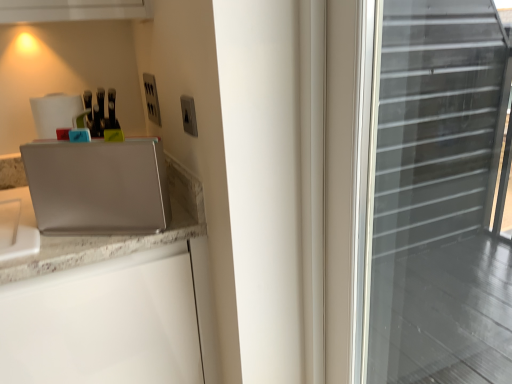
Identify the location of satin silver switch at upper center, which is the 2th electric outlet from back to front. (189, 115).

The width and height of the screenshot is (512, 384). Find the location of `satin silver outlet at upper center, placed as the 1th electric outlet when sorted from left to right`. satin silver outlet at upper center, placed as the 1th electric outlet when sorted from left to right is located at coordinates click(x=152, y=98).

You are a GUI agent. You are given a task and a screenshot of the screen. Output one action in this format:
    pyautogui.click(x=<x>, y=<y>)
    Task: Click on the satin silver switch at upper center, the first electric outlet in the front-to-back sequence
    The width and height of the screenshot is (512, 384).
    Given the screenshot: What is the action you would take?
    pyautogui.click(x=189, y=115)

Does satin silver switch at upper center, the first electric outlet in the front-to-back sequence, have a larger size compared to satin silver laptop at left?

Incorrect, satin silver switch at upper center, the first electric outlet in the front-to-back sequence, is not larger than satin silver laptop at left.

From a real-world perspective, which is physically above, satin silver switch at upper center, acting as the first electric outlet starting from the right, or satin silver laptop at left?

From a 3D spatial view, satin silver switch at upper center, acting as the first electric outlet starting from the right, is above.

Considering the relative sizes of satin silver switch at upper center, which is the 2th electric outlet from back to front, and satin silver laptop at left in the image provided, is satin silver switch at upper center, which is the 2th electric outlet from back to front, taller than satin silver laptop at left?

Incorrect, the height of satin silver switch at upper center, which is the 2th electric outlet from back to front, is not larger of that of satin silver laptop at left.

From the image's perspective, is satin silver laptop at left positioned above or below satin silver switch at upper center, which is the 2th electric outlet from back to front?

Based on their image positions, satin silver laptop at left is located beneath satin silver switch at upper center, which is the 2th electric outlet from back to front.

Which is correct: satin silver laptop at left is inside satin silver switch at upper center, acting as the first electric outlet starting from the right, or outside of it?

satin silver laptop at left is outside satin silver switch at upper center, acting as the first electric outlet starting from the right.

Considering the relative sizes of satin silver laptop at left and satin silver switch at upper center, acting as the second electric outlet starting from the left, in the image provided, is satin silver laptop at left thinner than satin silver switch at upper center, acting as the second electric outlet starting from the left,?

In fact, satin silver laptop at left might be wider than satin silver switch at upper center, acting as the second electric outlet starting from the left.

How many degrees apart are the facing directions of satin silver laptop at left and satin silver switch at upper center, which is the 2th electric outlet from back to front?

The facing directions of satin silver laptop at left and satin silver switch at upper center, which is the 2th electric outlet from back to front, are 57.9 degrees apart.

Can we say satin silver switch at upper center, acting as the second electric outlet starting from the left, lies outside satin silver outlet at upper center, which is the 2th electric outlet in front-to-back order?

Absolutely, satin silver switch at upper center, acting as the second electric outlet starting from the left, is external to satin silver outlet at upper center, which is the 2th electric outlet in front-to-back order.

Can you tell me how much satin silver switch at upper center, acting as the second electric outlet starting from the left, and satin silver outlet at upper center, positioned as the 1th electric outlet in back-to-front order, differ in facing direction?

There is a 0.0122-degree angle between the facing directions of satin silver switch at upper center, acting as the second electric outlet starting from the left, and satin silver outlet at upper center, positioned as the 1th electric outlet in back-to-front order.

Could you measure the distance between satin silver switch at upper center, acting as the first electric outlet starting from the right, and satin silver outlet at upper center, which is the 2th electric outlet from right to left?

satin silver switch at upper center, acting as the first electric outlet starting from the right, and satin silver outlet at upper center, which is the 2th electric outlet from right to left, are 12.96 inches apart.

Is satin silver switch at upper center, the first electric outlet in the front-to-back sequence, oriented away from satin silver outlet at upper center, which is the 2th electric outlet in front-to-back order?

That's not correct — satin silver switch at upper center, the first electric outlet in the front-to-back sequence, is not looking away from satin silver outlet at upper center, which is the 2th electric outlet in front-to-back order.

Is point (148, 79) positioned in front of point (185, 121)?

No.

Is satin silver outlet at upper center, placed as the 1th electric outlet when sorted from left to right, wider or thinner than satin silver switch at upper center, acting as the first electric outlet starting from the right?

satin silver outlet at upper center, placed as the 1th electric outlet when sorted from left to right, is wider than satin silver switch at upper center, acting as the first electric outlet starting from the right.

Identify the location of electric outlet behind the satin silver switch at upper center, acting as the first electric outlet starting from the right. (152, 98).

Based on the photo, is satin silver outlet at upper center, which is the 2th electric outlet in front-to-back order, positioned with its back to satin silver switch at upper center, acting as the first electric outlet starting from the right?

No, satin silver outlet at upper center, which is the 2th electric outlet in front-to-back order,'s orientation is not away from satin silver switch at upper center, acting as the first electric outlet starting from the right.

Considering the relative positions of satin silver outlet at upper center, placed as the 1th electric outlet when sorted from left to right, and satin silver laptop at left in the image provided, is satin silver outlet at upper center, placed as the 1th electric outlet when sorted from left to right, to the right of satin silver laptop at left from the viewer's perspective?

Correct, you'll find satin silver outlet at upper center, placed as the 1th electric outlet when sorted from left to right, to the right of satin silver laptop at left.

Is satin silver laptop at left at the back of satin silver outlet at upper center, placed as the 1th electric outlet when sorted from left to right?

No, satin silver laptop at left is not at the back of satin silver outlet at upper center, placed as the 1th electric outlet when sorted from left to right.

Considering the points (154, 84) and (135, 174), which point is in front, point (154, 84) or point (135, 174)?

The point (135, 174) is closer to the camera.

How different are the orientations of satin silver outlet at upper center, placed as the 1th electric outlet when sorted from left to right, and satin silver laptop at left in degrees?

The angular difference between satin silver outlet at upper center, placed as the 1th electric outlet when sorted from left to right, and satin silver laptop at left is 57.9 degrees.

Considering the positions of objects satin silver laptop at left and satin silver outlet at upper center, which is the 2th electric outlet in front-to-back order, in the image provided, who is more to the right, satin silver laptop at left or satin silver outlet at upper center, which is the 2th electric outlet in front-to-back order,?

Positioned to the right is satin silver outlet at upper center, which is the 2th electric outlet in front-to-back order.

Looking at this image, measure the distance between satin silver laptop at left and satin silver outlet at upper center, positioned as the 1th electric outlet in back-to-front order.

satin silver laptop at left is 14.16 inches from satin silver outlet at upper center, positioned as the 1th electric outlet in back-to-front order.

Between satin silver laptop at left and satin silver outlet at upper center, positioned as the 1th electric outlet in back-to-front order, which one has more height?

satin silver laptop at left is taller.

Where is `appliance on the left of the satin silver switch at upper center, which is the 2th electric outlet from back to front`? appliance on the left of the satin silver switch at upper center, which is the 2th electric outlet from back to front is located at coordinates (98, 186).

Where is `the 1st electric outlet above when counting from the satin silver laptop at left (from the image's perspective)`? This screenshot has width=512, height=384. the 1st electric outlet above when counting from the satin silver laptop at left (from the image's perspective) is located at coordinates (189, 115).

When comparing their distances from satin silver switch at upper center, acting as the first electric outlet starting from the right, does satin silver outlet at upper center, positioned as the 1th electric outlet in back-to-front order, or satin silver laptop at left seem closer?

The object closer to satin silver switch at upper center, acting as the first electric outlet starting from the right, is satin silver laptop at left.

Looking at this image, estimate the real-world distances between objects in this image. Which object is closer to satin silver laptop at left, satin silver switch at upper center, the first electric outlet in the front-to-back sequence, or satin silver outlet at upper center, which is the 2th electric outlet from right to left?

satin silver switch at upper center, the first electric outlet in the front-to-back sequence, is closer to satin silver laptop at left.

Looking at the image, which one is located closer to satin silver laptop at left, satin silver outlet at upper center, positioned as the 1th electric outlet in back-to-front order, or satin silver switch at upper center, the first electric outlet in the front-to-back sequence?

Based on the image, satin silver switch at upper center, the first electric outlet in the front-to-back sequence, appears to be nearer to satin silver laptop at left.

Looking at the image, which one is located further to satin silver switch at upper center, acting as the second electric outlet starting from the left, satin silver laptop at left or satin silver outlet at upper center, placed as the 1th electric outlet when sorted from left to right?

satin silver outlet at upper center, placed as the 1th electric outlet when sorted from left to right, is positioned further to the anchor satin silver switch at upper center, acting as the second electric outlet starting from the left.

Looking at the image, which one is located closer to satin silver outlet at upper center, which is the 2th electric outlet in front-to-back order, satin silver switch at upper center, which is the 2th electric outlet from back to front, or satin silver laptop at left?

satin silver switch at upper center, which is the 2th electric outlet from back to front, is closer to satin silver outlet at upper center, which is the 2th electric outlet in front-to-back order.

Based on their spatial positions, is satin silver laptop at left or satin silver switch at upper center, which is the 2th electric outlet from back to front, further from satin silver outlet at upper center, which is the 2th electric outlet in front-to-back order?

satin silver laptop at left is positioned further to the anchor satin silver outlet at upper center, which is the 2th electric outlet in front-to-back order.

This screenshot has width=512, height=384. I want to click on electric outlet between satin silver laptop at left and satin silver outlet at upper center, placed as the 1th electric outlet when sorted from left to right, in the front-back direction, so click(x=189, y=115).